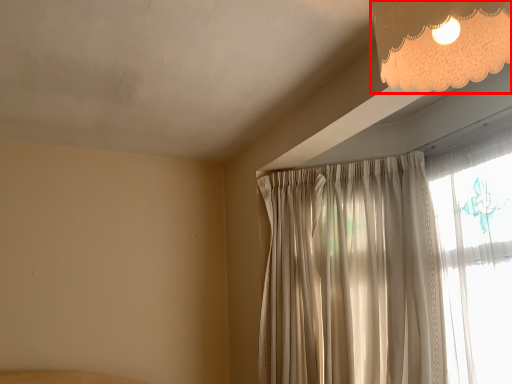
Question: From the image's perspective, where is lamp (annotated by the red box) located in relation to curtain in the image?

Choices:
 (A) below
 (B) above

Answer: (B)